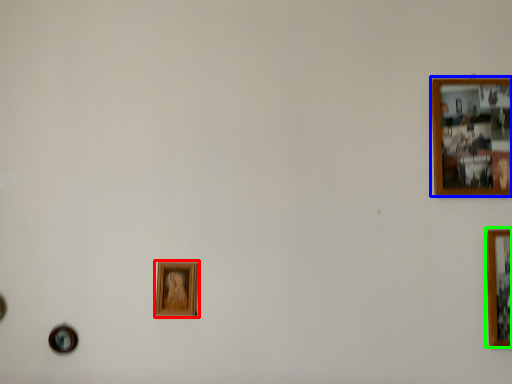
Question: Which is farther away from picture frame (highlighted by a red box)? picture frame (highlighted by a blue box) or picture frame (highlighted by a green box)?

Choices:
 (A) picture frame
 (B) picture frame

Answer: (B)